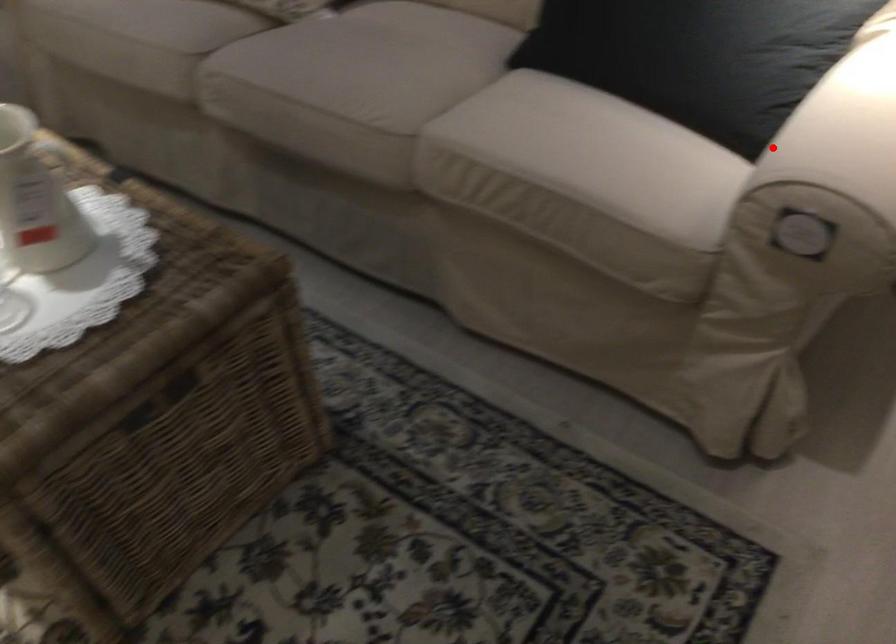
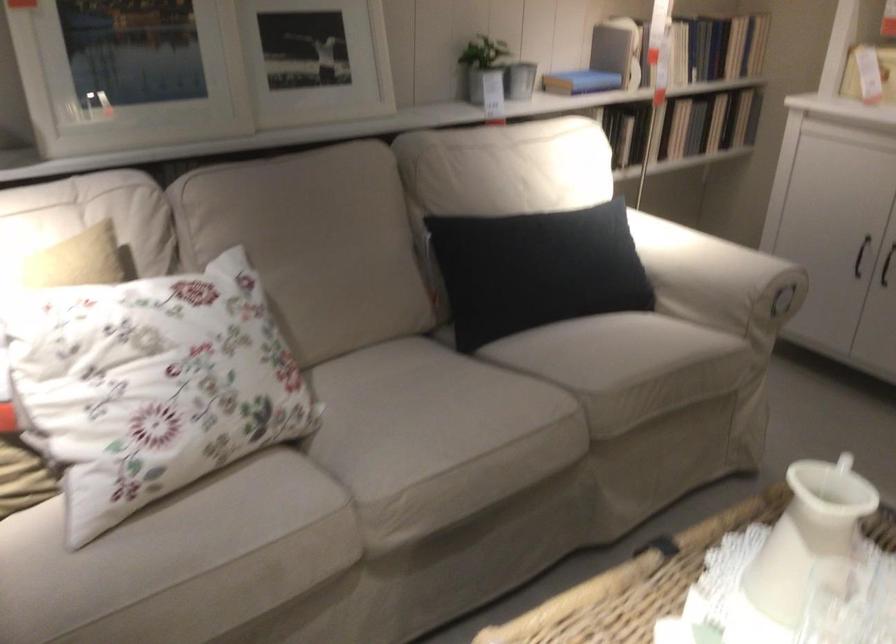
Where in the second image is the point corresponding to the highlighted location from the first image?

(717, 279)